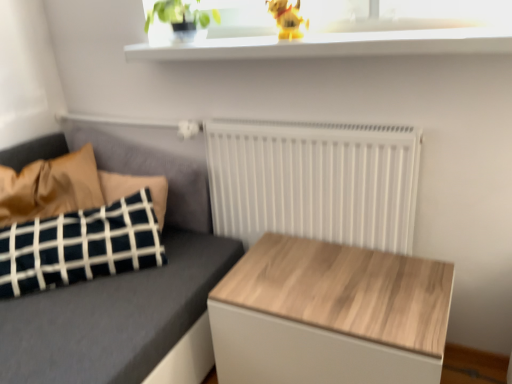
At what (x,y) coordinates should I click in order to perform the action: click on free space above wooden table at center (from a real-world perspective). Please return your answer as a coordinate pair (x, y). The height and width of the screenshot is (384, 512). Looking at the image, I should click on (334, 277).